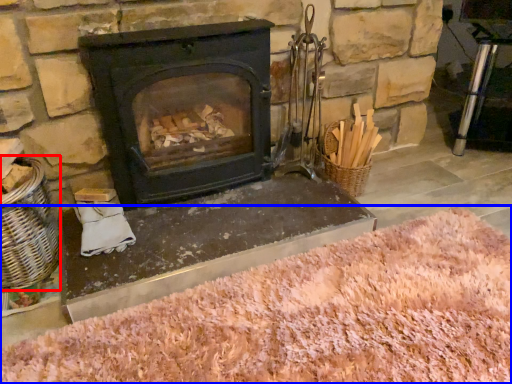
Question: Among these objects, which one is nearest to the camera, basket (highlighted by a red box) or sand (highlighted by a blue box)?

Choices:
 (A) basket
 (B) sand

Answer: (B)